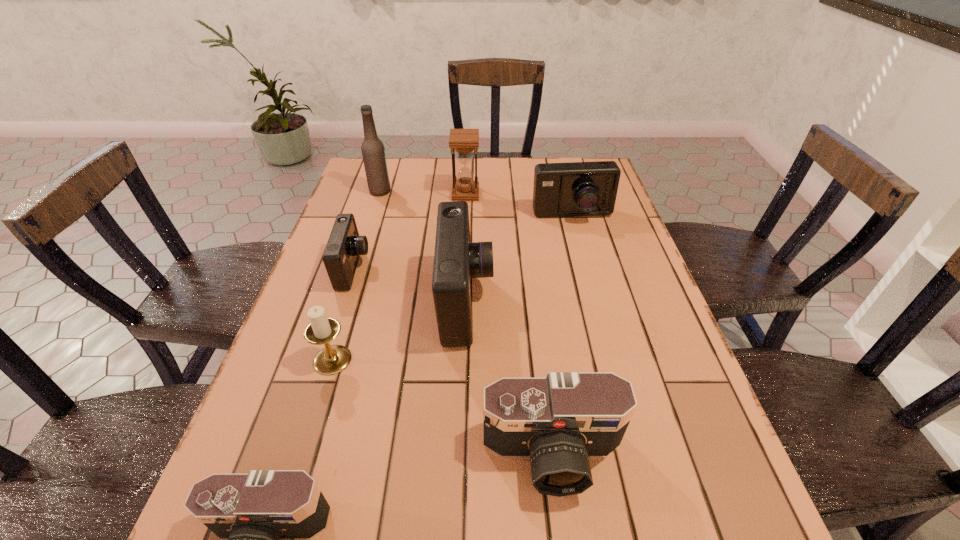
Identify the location of camera identified as the closest to the candle holder. The height and width of the screenshot is (540, 960). (344, 246).

This screenshot has height=540, width=960. I want to click on blue camera that is the closest to the smaller black camera, so click(457, 260).

The image size is (960, 540). I want to click on blue camera that stands as the closest to the second blue camera from left to right, so click(x=344, y=246).

This screenshot has width=960, height=540. Identify the location of vacant point that satisfies the following two spatial constraints: 1. on the back side of the hourglass; 2. on the side of the tallest object with the label. (466, 191).

What are the coordinates of `vacant position in the image that satisfies the following two spatial constraints: 1. on the back side of the hourglass; 2. on the right side of the white candle holder` in the screenshot? It's located at (383, 194).

Where is `vacant space that satisfies the following two spatial constraints: 1. on the back side of the white candle holder; 2. on the front-facing side of the leftmost blue camera`? vacant space that satisfies the following two spatial constraints: 1. on the back side of the white candle holder; 2. on the front-facing side of the leftmost blue camera is located at coordinates (360, 269).

Image resolution: width=960 pixels, height=540 pixels. In order to click on free space that satisfies the following two spatial constraints: 1. on the side of the beer bottle with the label; 2. on the right side of the hourglass in this screenshot , I will do `click(379, 194)`.